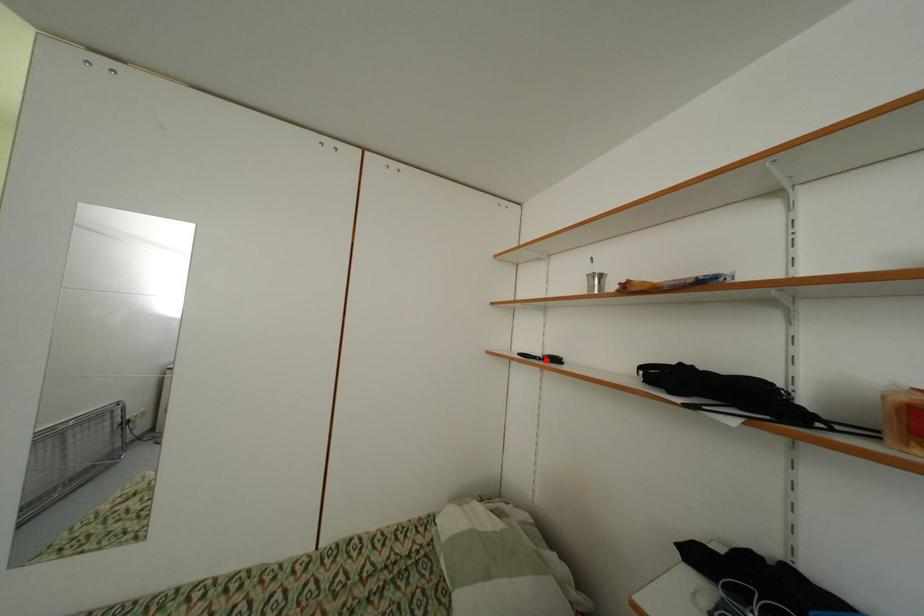
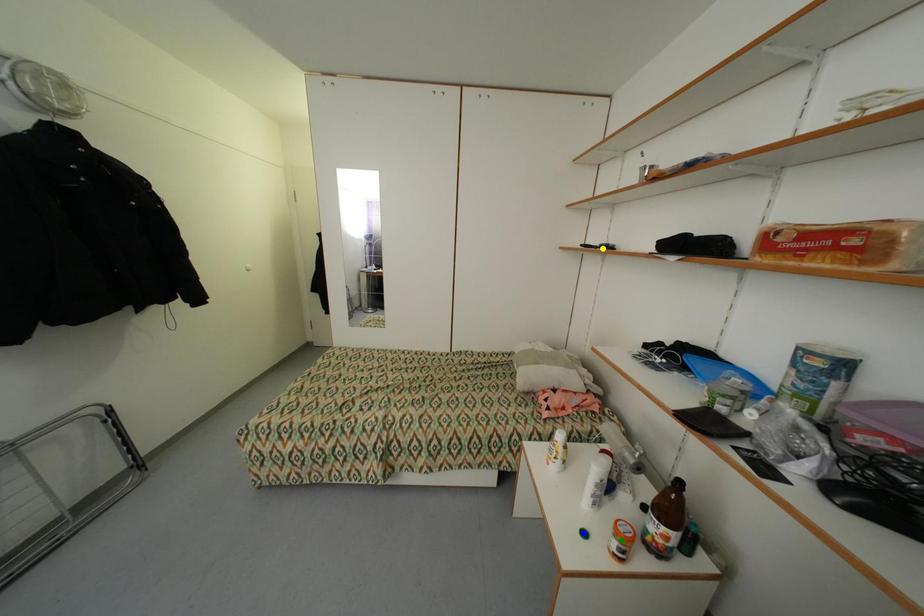
Question: I am providing you with two images of the same scene from different viewpoints. A red point is marked on the first image. You are given multiple points on the second image. Can you choose the point in image 2 that corresponds to the point in image 1?

Choices:
 (A) green point
 (B) blue point
 (C) yellow point

Answer: (C)